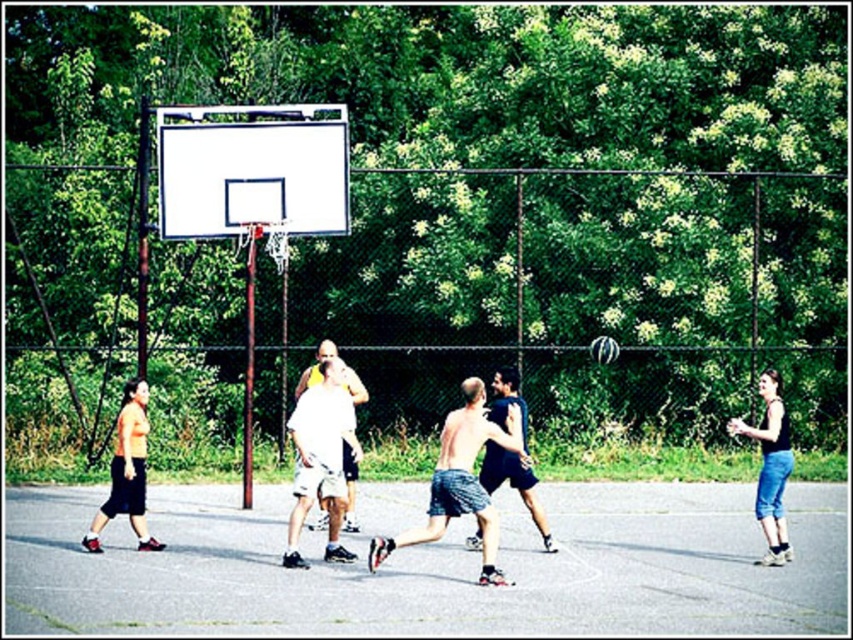
Is skinny jeans at center smaller than white matte basketball player at center?

No, skinny jeans at center is not smaller than white matte basketball player at center.

Is point (465, 513) in front of point (318, 356)?

Yes, point (465, 513) is closer to viewer.

Where is `skinny jeans at center`? Image resolution: width=853 pixels, height=640 pixels. skinny jeans at center is located at coordinates (462, 481).

Between point (103, 512) and point (770, 545), which one is positioned in front?

Point (103, 512) is in front.

Does orange shirt at left have a lesser height compared to black tank top at right?

Indeed, orange shirt at left has a lesser height compared to black tank top at right.

Who is more distant from viewer, (x=109, y=516) or (x=776, y=428)?

Point (x=776, y=428)

Where is `orange shirt at left`? The width and height of the screenshot is (853, 640). orange shirt at left is located at coordinates (126, 472).

Does gray asphalt court at center appear over black tank top at right?

No, gray asphalt court at center is not above black tank top at right.

Does gray asphalt court at center appear on the right side of black tank top at right?

Incorrect, gray asphalt court at center is not on the right side of black tank top at right.

Which is in front, point (602, 600) or point (753, 509)?

Point (602, 600) is more forward.

Where is `gray asphalt court at center`? This screenshot has height=640, width=853. gray asphalt court at center is located at coordinates (432, 566).